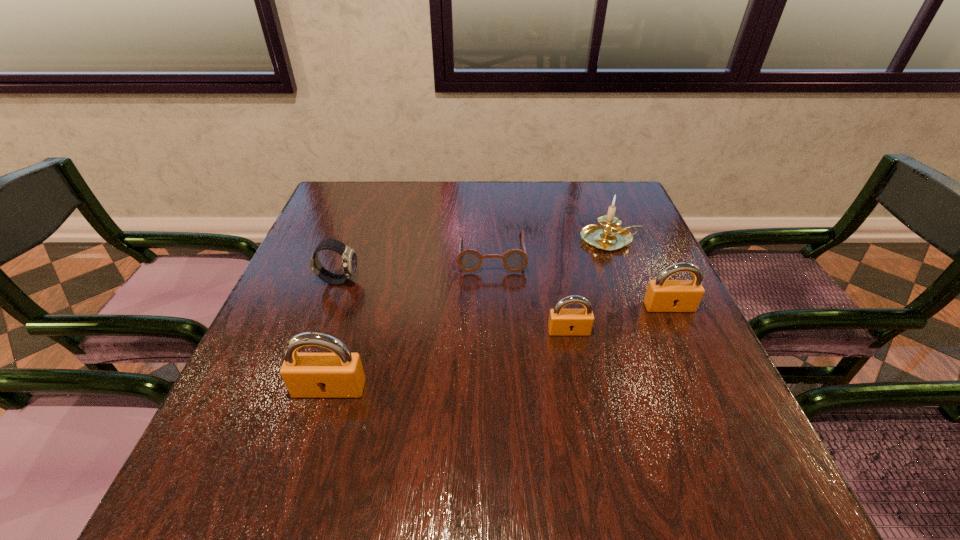
Locate an element on the screen. This screenshot has height=540, width=960. free space located to unlock the leftmost padlock from the front is located at coordinates (316, 435).

Find the location of a particular element. Image resolution: width=960 pixels, height=540 pixels. vacant space situated 0.200m to unlock the shortest padlock from the front is located at coordinates (588, 423).

Find the location of a particular element. vacant region located 0.120m to unlock the fourth farthest object from the front is located at coordinates (691, 356).

Find the location of a particular element. vacant space situated on the face of the watch is located at coordinates 405,280.

Locate an element on the screen. The width and height of the screenshot is (960, 540). free space located on the front-facing side of the shortest object is located at coordinates (494, 352).

Identify the location of object situated at the near edge. tap(340, 374).

This screenshot has width=960, height=540. Find the location of `padlock present at the left edge`. padlock present at the left edge is located at coordinates (340, 374).

Locate an element on the screen. Image resolution: width=960 pixels, height=540 pixels. watch present at the left edge is located at coordinates (349, 259).

I want to click on padlock at the right edge, so (x=662, y=295).

At what (x,y) coordinates should I click in order to perform the action: click on candle holder situated at the right edge. Please return your answer as a coordinate pair (x, y). This screenshot has height=540, width=960. Looking at the image, I should click on (610, 236).